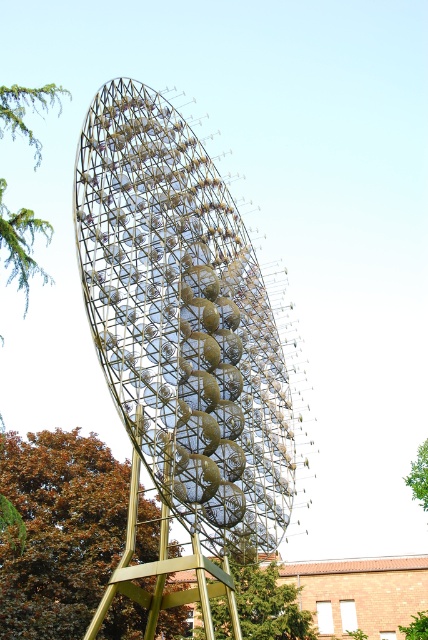
Between metallic structure at center and green leafy tree at lower center, which one appears on the right side from the viewer's perspective?

green leafy tree at lower center

Does metallic structure at center come in front of green leafy tree at lower center?

Yes, it is.

At what (x,y) coordinates should I click in order to perform the action: click on metallic structure at center. Please return your answer as a coordinate pair (x, y). The image size is (428, 640). Looking at the image, I should click on (183, 321).

Can you confirm if metallic structure at center is wider than green leafy tree at upper right?

Indeed, metallic structure at center has a greater width compared to green leafy tree at upper right.

The width and height of the screenshot is (428, 640). Identify the location of metallic structure at center. (183, 321).

Does metallic structure at center have a lesser width compared to green leafy tree at lower left?

Yes.

Is metallic structure at center to the left of green leafy tree at lower left from the viewer's perspective?

In fact, metallic structure at center is to the right of green leafy tree at lower left.

I want to click on metallic structure at center, so click(x=183, y=321).

Identify the location of metallic structure at center. (183, 321).